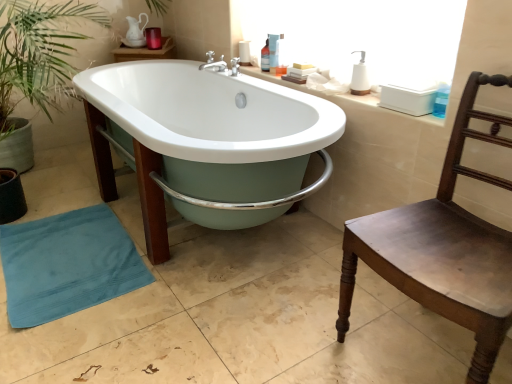
Question: Is point pyautogui.click(x=267, y=49) positioned closer to the camera than point pyautogui.click(x=355, y=79)?

Choices:
 (A) closer
 (B) farther

Answer: (B)

Question: In terms of height, does translucent plastic bottle at upper center, placed as the 4th toiletry when sorted from front to back, look taller or shorter compared to white matte soap dispenser at upper right, which is counted as the fourth toiletry, starting from the left?

Choices:
 (A) short
 (B) tall

Answer: (B)

Question: Considering the real-world distances, which object is closest to the translucent plastic soap dispenser at upper center, the 3th toiletry when ordered from right to left?

Choices:
 (A) white ceramic counter top at upper right
 (B) brown wooden chair at right
 (C) white glossy bathtub at center
 (D) translucent plastic bottle at upper center, placed as the 4th toiletry when sorted from right to left
 (E) translucent plastic soap dispenser at upper center, which is the third toiletry in left-to-right order

Answer: (E)

Question: Estimate the real-world distances between objects in this image. Which object is farther from the blue terry cloth beach towel at lower left?

Choices:
 (A) brown wooden chair at right
 (B) translucent plastic soap dispenser at upper center, arranged as the third toiletry when viewed from the front
 (C) white matte soap dispenser at upper right, the 1th toiletry when ordered from right to left
 (D) translucent plastic bottle at upper center, placed as the 4th toiletry when sorted from front to back
 (E) translucent plastic soap dispenser at upper center, acting as the second toiletry starting from the right

Answer: (C)